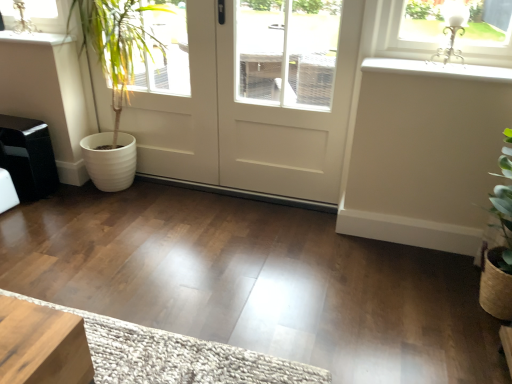
Question: Can you confirm if white smooth window sill at upper right, the 2th window sill positioned from the left, is shorter than white textured doormat at lower center?

Choices:
 (A) no
 (B) yes

Answer: (A)

Question: Does white smooth window sill at upper right, the 2th window sill positioned from the left, have a lesser width compared to white textured doormat at lower center?

Choices:
 (A) yes
 (B) no

Answer: (A)

Question: From the image's perspective, is white smooth window sill at upper right, which is the first window sill from right to left, over white textured doormat at lower center?

Choices:
 (A) no
 (B) yes

Answer: (B)

Question: Is white smooth window sill at upper right, which is the first window sill from right to left, next to white textured doormat at lower center and touching it?

Choices:
 (A) yes
 (B) no

Answer: (B)

Question: Is the depth of white smooth window sill at upper right, arranged as the first window sill when viewed from the front, greater than that of white textured doormat at lower center?

Choices:
 (A) yes
 (B) no

Answer: (A)

Question: Is white smooth window sill at upper right, the 2th window sill positioned from the left, positioned in front of white textured doormat at lower center?

Choices:
 (A) no
 (B) yes

Answer: (A)

Question: Does white matte door at center touch white glossy window sill at upper left, which ranks as the second window sill in bottom-to-top order?

Choices:
 (A) no
 (B) yes

Answer: (A)

Question: Does white matte door at center contain white glossy window sill at upper left, which ranks as the second window sill in bottom-to-top order?

Choices:
 (A) yes
 (B) no

Answer: (B)

Question: From the image's perspective, does white matte door at center appear lower than white glossy window sill at upper left, the first window sill in the left-to-right sequence?

Choices:
 (A) yes
 (B) no

Answer: (A)

Question: Can you confirm if white matte door at center is taller than white glossy window sill at upper left, the first window sill in the left-to-right sequence?

Choices:
 (A) no
 (B) yes

Answer: (B)

Question: Does white matte door at center have a lesser height compared to white glossy window sill at upper left, the 2th window sill in the front-to-back sequence?

Choices:
 (A) no
 (B) yes

Answer: (A)

Question: From a real-world perspective, is white matte door at center located beneath white glossy window sill at upper left, the 2th window sill in the front-to-back sequence?

Choices:
 (A) no
 (B) yes

Answer: (B)

Question: Is white matte door at center further to the viewer compared to white ribbed pot at left?

Choices:
 (A) yes
 (B) no

Answer: (B)